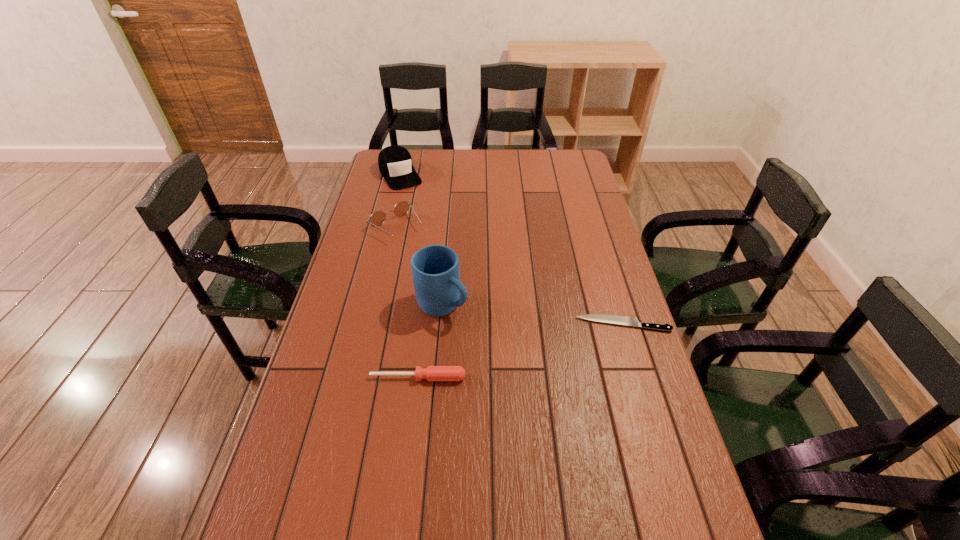
Identify the location of screwdriver. This screenshot has height=540, width=960. (432, 373).

Where is `the nearest object`? The width and height of the screenshot is (960, 540). the nearest object is located at coordinates (432, 373).

Where is `steak knife`? steak knife is located at coordinates (612, 319).

Locate an element on the screen. the shortest object is located at coordinates (612, 319).

Where is `the fourth shortest object`? the fourth shortest object is located at coordinates (395, 164).

Identify the location of cap. Image resolution: width=960 pixels, height=540 pixels. (395, 164).

Where is `the third shortest object`? Image resolution: width=960 pixels, height=540 pixels. the third shortest object is located at coordinates (401, 208).

Where is `spectacles`? This screenshot has width=960, height=540. spectacles is located at coordinates (401, 208).

Locate an element on the screen. Image resolution: width=960 pixels, height=540 pixels. the tallest object is located at coordinates (435, 268).

The height and width of the screenshot is (540, 960). I want to click on vacant space positioned at the tip of the second shortest object, so (x=415, y=407).